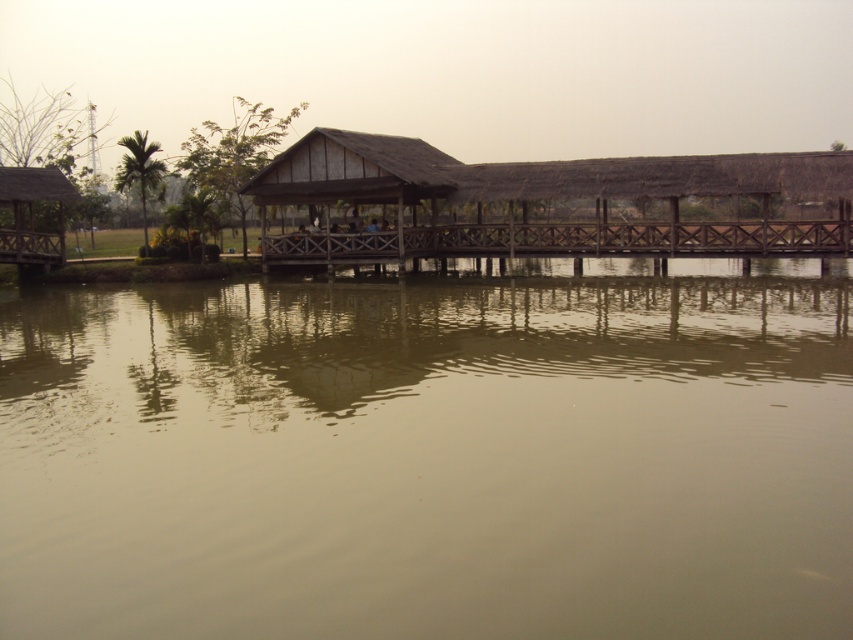
Who is lower down, brown murky water at center or wooden thatched hut at center?

Positioned lower is brown murky water at center.

Is brown murky water at center wider than wooden thatched hut at center?

Incorrect, brown murky water at center's width does not surpass wooden thatched hut at center's.

Between point (18, 476) and point (492, 164), which one is positioned behind?

The point (492, 164) is behind.

Image resolution: width=853 pixels, height=640 pixels. Identify the location of brown murky water at center. (431, 454).

How distant is wooden thatched hut at center from brown wooden dock at center?

wooden thatched hut at center and brown wooden dock at center are 5.61 feet apart.

Which of these two, wooden thatched hut at center or brown wooden dock at center, stands taller?

wooden thatched hut at center

Where is `wooden thatched hut at center`? Image resolution: width=853 pixels, height=640 pixels. wooden thatched hut at center is located at coordinates (549, 204).

Locate an element on the screen. This screenshot has width=853, height=640. wooden thatched hut at center is located at coordinates (549, 204).

Can you confirm if brown wooden dock at center is positioned to the left of wooden hut at left?

No, brown wooden dock at center is not to the left of wooden hut at left.

Is brown wooden dock at center bigger than wooden hut at left?

Correct, brown wooden dock at center is larger in size than wooden hut at left.

What do you see at coordinates (556, 241) in the screenshot? This screenshot has width=853, height=640. I see `brown wooden dock at center` at bounding box center [556, 241].

Where is `brown wooden dock at center`? The height and width of the screenshot is (640, 853). brown wooden dock at center is located at coordinates tap(556, 241).